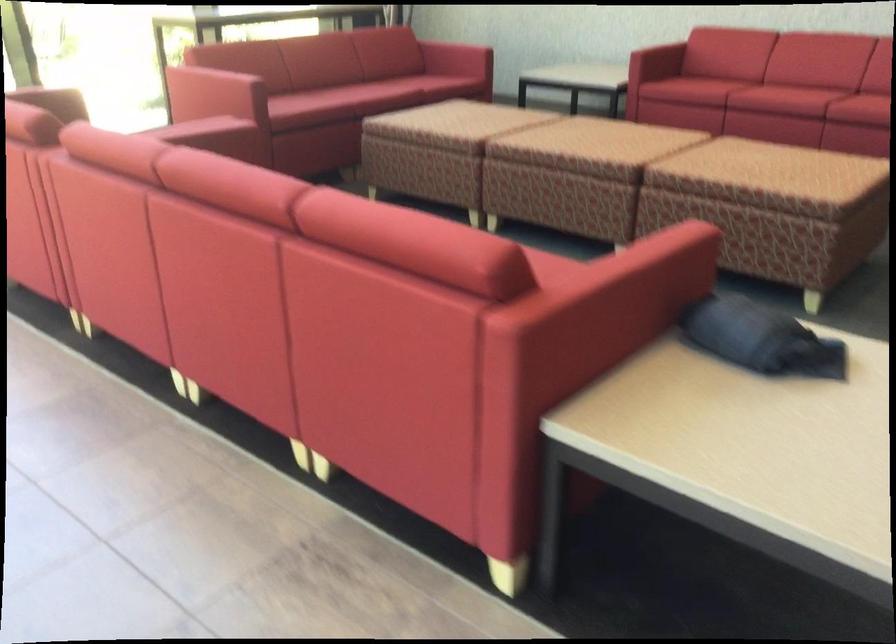
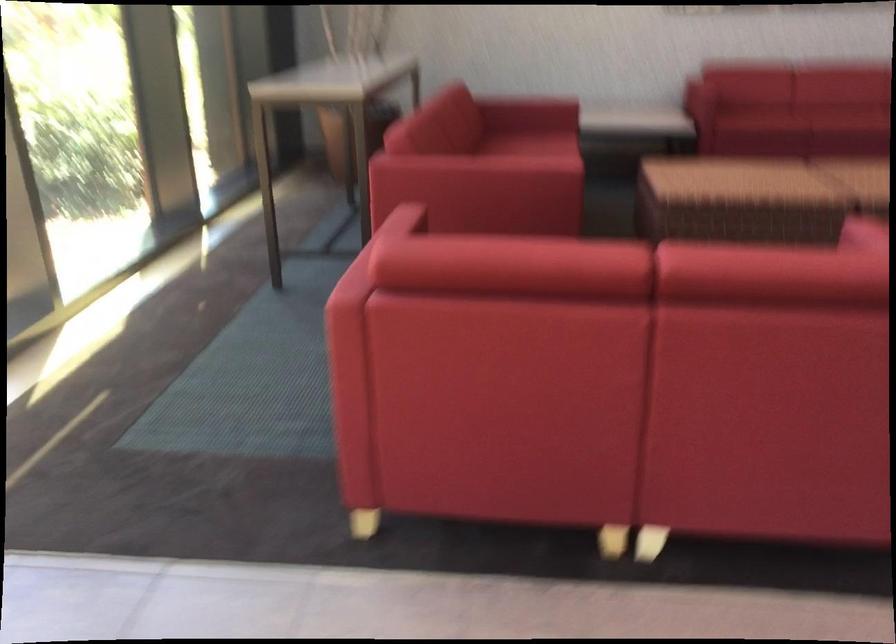
Question: What movement of the cameraman would produce the second image?

Choices:
 (A) Left
 (B) Right
 (C) Forward
 (D) Backward

Answer: (D)